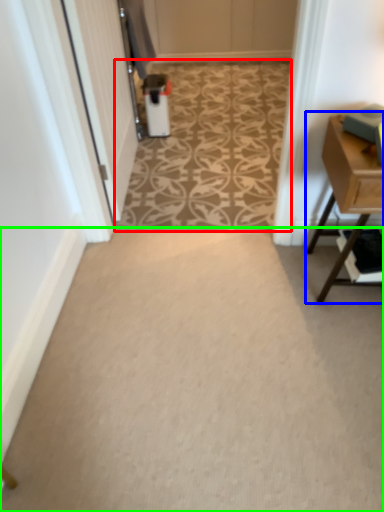
Question: Based on their relative distances, which object is nearer to pattern (highlighted by a red box)? Choose from table (highlighted by a blue box) and plain (highlighted by a green box).

Choices:
 (A) table
 (B) plain

Answer: (B)